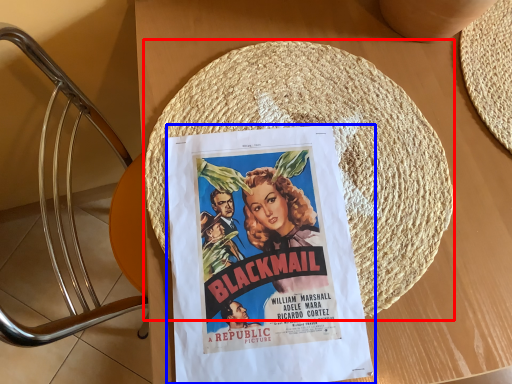
Question: Among these objects, which one is nearest to the camera, straw hat (highlighted by a red box) or poster (highlighted by a blue box)?

Choices:
 (A) straw hat
 (B) poster

Answer: (B)